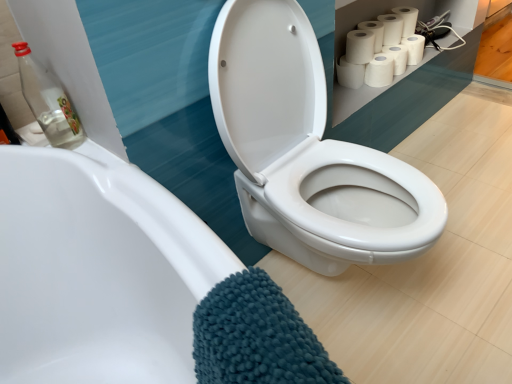
Question: Based on their sizes in the image, would you say transparent glass bottle at upper left is bigger or smaller than white matte toilet paper at upper right, positioned as the 5th toilet paper in right-to-left order?

Choices:
 (A) small
 (B) big

Answer: (B)

Question: Considering the positions of transparent glass bottle at upper left and white matte toilet paper at upper right, the third toilet paper in the left-to-right sequence, in the image, is transparent glass bottle at upper left wider or thinner than white matte toilet paper at upper right, the third toilet paper in the left-to-right sequence,?

Choices:
 (A) wide
 (B) thin

Answer: (B)

Question: Considering the real-world distances, which object is farthest from the white matte toilet paper at upper right, which is the 6th toilet paper in right-to-left order?

Choices:
 (A) white glossy toilet at center
 (B) teal chenille bath towel at lower left
 (C) white matte toilet paper at upper right, the third toilet paper in the left-to-right sequence
 (D) white matte toilet paper at upper right, marked as the 5th toilet paper in a left-to-right arrangement
 (E) white matte toilet paper at upper right, which is the 4th toilet paper in left-to-right order

Answer: (B)

Question: Estimate the real-world distances between objects in this image. Which object is closer to the transparent glass bottle at upper left?

Choices:
 (A) teal chenille bath towel at lower left
 (B) white matte toilet paper at upper right, the 7th toilet paper when ordered from left to right
 (C) white matte toilet paper at upper right, the third toilet paper in the left-to-right sequence
 (D) white matte toilet paper at upper right, positioned as the 1th toilet paper in left-to-right order
 (E) white glossy toilet at center

Answer: (E)